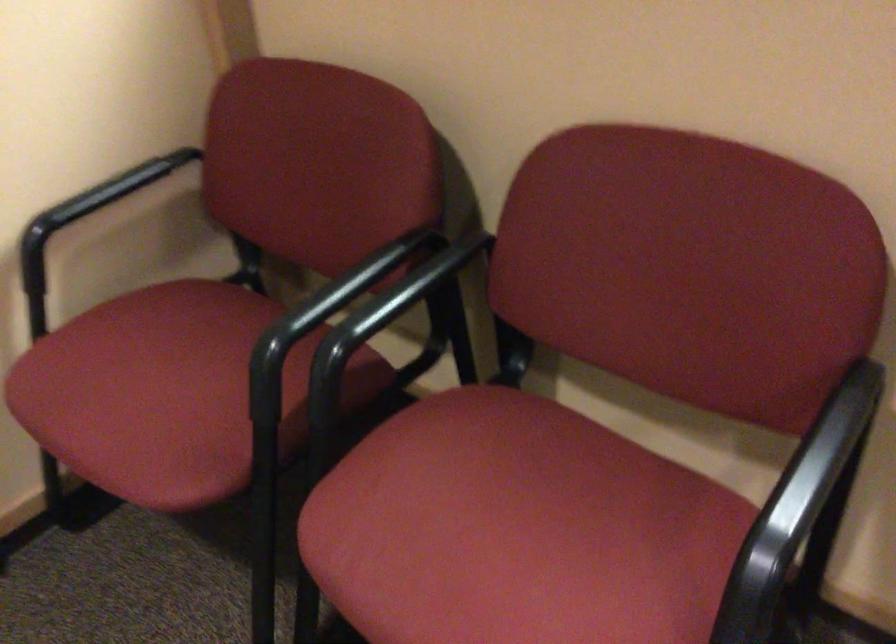
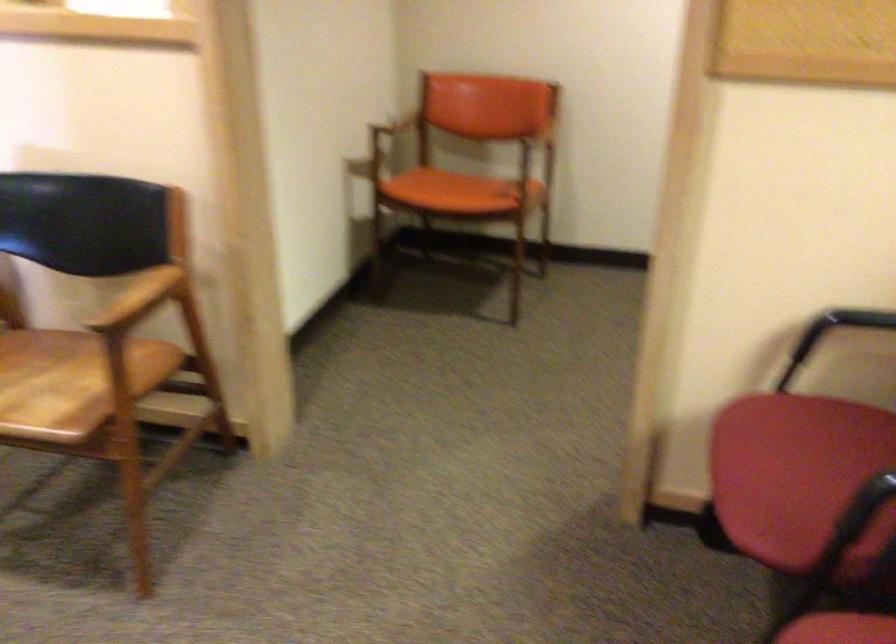
Question: The camera is either moving clockwise (left) or counter-clockwise (right) around the object. The first image is from the beginning of the video and the second image is from the end. Is the camera moving left or right when shooting the video?

Choices:
 (A) Left
 (B) Right

Answer: (B)